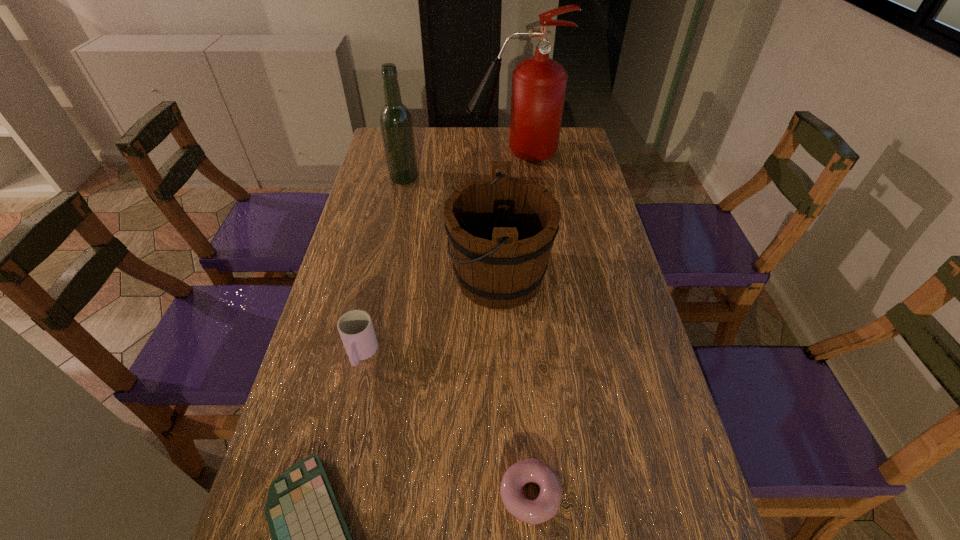
Choose which object is the third nearest neighbor to the fourth tallest object. Please provide its 2D coordinates. Your answer should be formatted as a tuple, i.e. [(x, y)], where the tuple contains the x and y coordinates of a point satisfying the conditions above.

[(533, 512)]

You are a GUI agent. You are given a task and a screenshot of the screen. Output one action in this format:
    pyautogui.click(x=<x>, y=<y>)
    Task: Click on the object that is the second closest to the farthest object
    
    Given the screenshot: What is the action you would take?
    pyautogui.click(x=501, y=229)

The image size is (960, 540). Find the location of `vacant region that satisfies the following two spatial constraints: 1. on the back side of the doughnut; 2. on the side of the wine bucket with the handle for carrying`. vacant region that satisfies the following two spatial constraints: 1. on the back side of the doughnut; 2. on the side of the wine bucket with the handle for carrying is located at coordinates (514, 278).

Locate an element on the screen. This screenshot has width=960, height=540. vacant area in the image that satisfies the following two spatial constraints: 1. on the side of the wine bucket with the handle for carrying; 2. on the back side of the fifth tallest object is located at coordinates (509, 494).

Identify the location of vacant space that satisfies the following two spatial constraints: 1. on the side of the fourth nearest object with the handle for carrying; 2. on the right side of the doughnut. (509, 494).

Identify the location of vacant space that satisfies the following two spatial constraints: 1. with the nozzle aimed from the farthest object; 2. on the front side of the doughnut. This screenshot has width=960, height=540. (547, 494).